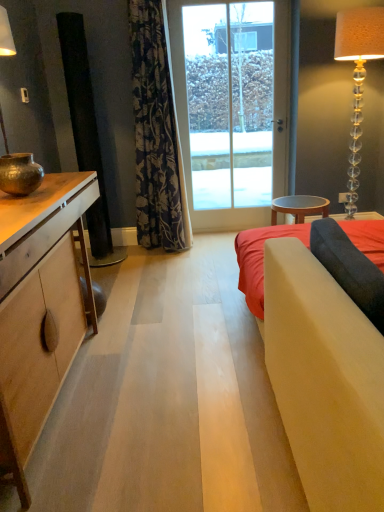
Question: Considering their positions, is clear glass floor lamp at right located in front of or behind wooden stool at center?

Choices:
 (A) front
 (B) behind

Answer: (A)

Question: Looking at their shapes, would you say clear glass floor lamp at right is wider or thinner than wooden stool at center?

Choices:
 (A) wide
 (B) thin

Answer: (B)

Question: Considering the real-world distances, which object is closest to the transparent glass door at center?

Choices:
 (A) matte wood cabinet at left
 (B) dark floral fabric curtain at center
 (C) clear glass floor lamp at right
 (D) wooden stool at center
 (E) velvet gray pillow at right

Answer: (C)

Question: Which object is positioned farthest from the clear glass floor lamp at right?

Choices:
 (A) wooden stool at center
 (B) matte wood cabinet at left
 (C) velvet gray pillow at right
 (D) transparent glass door at center
 (E) dark floral fabric curtain at center

Answer: (B)